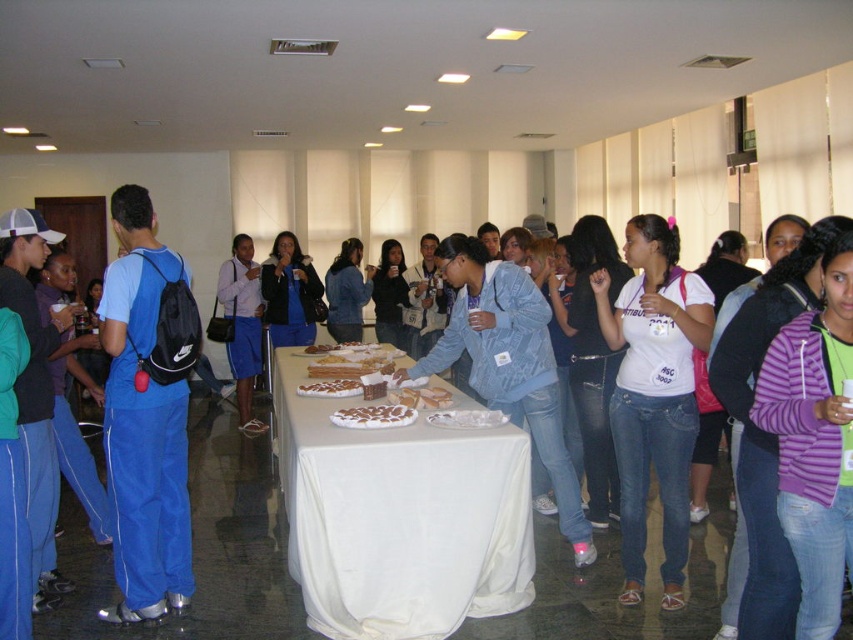
Can you confirm if white cloth table at center is positioned above chocolate-coated pastry at center?

No, white cloth table at center is not above chocolate-coated pastry at center.

Is point (306, 476) positioned behind point (352, 422)?

No, (306, 476) is in front of (352, 422).

This screenshot has height=640, width=853. I want to click on white cloth table at center, so tap(399, 516).

Find the location of `white cloth table at center`. white cloth table at center is located at coordinates click(399, 516).

Between chocolate-coated pastry at center and white textured cake at center, which one has more height?

chocolate-coated pastry at center

Is chocolate-coated pastry at center above white textured cake at center?

Incorrect, chocolate-coated pastry at center is not positioned above white textured cake at center.

Does point (364, 419) come farther from viewer compared to point (312, 381)?

No, (364, 419) is closer to viewer.

This screenshot has height=640, width=853. Identify the location of chocolate-coated pastry at center. pyautogui.click(x=374, y=417).

This screenshot has height=640, width=853. What do you see at coordinates (399, 516) in the screenshot?
I see `white cloth table at center` at bounding box center [399, 516].

Can you confirm if white cloth table at center is smaller than white textured cake at center?

No, white cloth table at center is not smaller than white textured cake at center.

Who is more distant from viewer, [289,572] or [312,396]?

Positioned behind is point [312,396].

I want to click on white cloth table at center, so click(x=399, y=516).